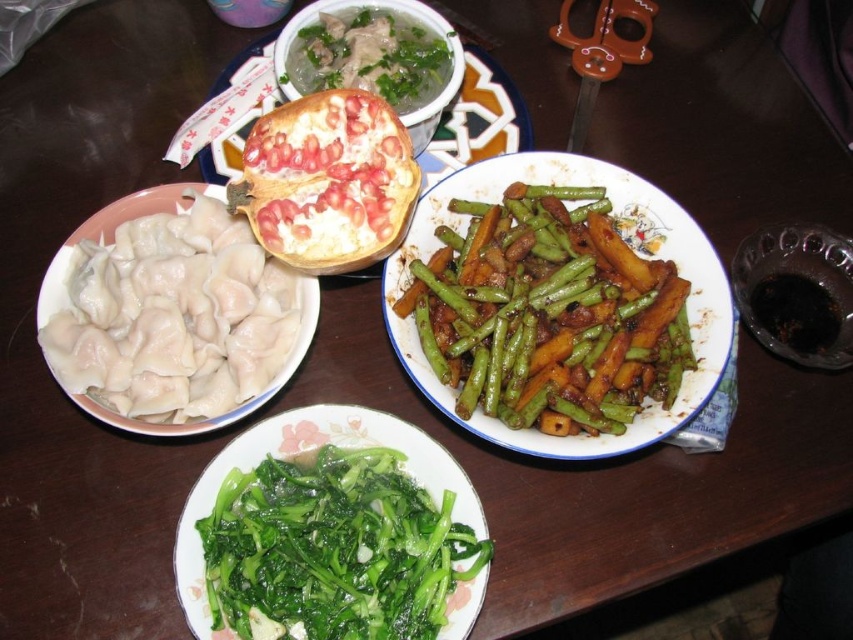
Question: Considering the real-world distances, which object is closest to the green glossy string beans at center right?

Choices:
 (A) green leafy vegetables at bottom
 (B) pomegranate seeds at center
 (C) white dumplings at left
 (D) green leafy vegetables at center

Answer: (B)

Question: Which point appears closest to the camera in this image?

Choices:
 (A) pos(149,353)
 (B) pos(326,170)
 (C) pos(442,65)
 (D) pos(524,387)

Answer: (A)

Question: Does pomegranate seeds at center appear under green leafy vegetables at center?

Choices:
 (A) no
 (B) yes

Answer: (B)

Question: Considering the real-world distances, which object is farthest from the green leafy vegetables at center?

Choices:
 (A) pomegranate seeds at center
 (B) green leafy vegetables at bottom

Answer: (B)

Question: Where is white dumplings at left located in relation to green leafy vegetables at bottom in the image?

Choices:
 (A) right
 (B) left

Answer: (B)

Question: Can you confirm if white dumplings at left is thinner than pomegranate seeds at center?

Choices:
 (A) no
 (B) yes

Answer: (A)